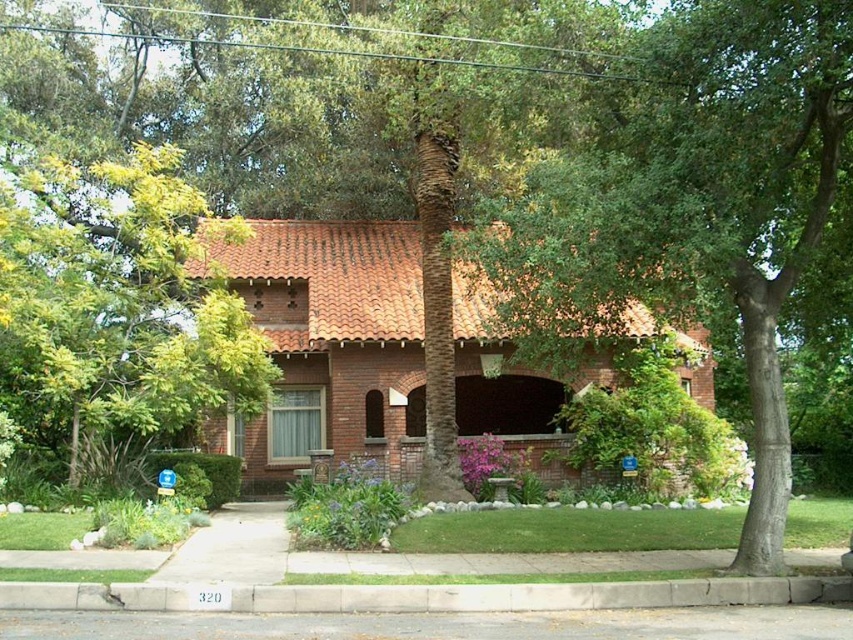
Question: Among these objects, which one is farthest from the camera?

Choices:
 (A) green leafy tree at upper left
 (B) gray concrete curb at lower center

Answer: (A)

Question: Can you confirm if green leafy tree at center is positioned below gray concrete curb at lower center?

Choices:
 (A) yes
 (B) no

Answer: (B)

Question: Can you confirm if green leafy tree at upper left is wider than gray concrete curb at lower center?

Choices:
 (A) no
 (B) yes

Answer: (B)

Question: Which of the following is the farthest from the observer?

Choices:
 (A) (144, 611)
 (B) (108, 188)
 (C) (662, 266)

Answer: (B)

Question: Is green leafy tree at center to the left of green leafy tree at upper left from the viewer's perspective?

Choices:
 (A) no
 (B) yes

Answer: (A)

Question: Which object appears closest to the camera in this image?

Choices:
 (A) green leafy tree at center
 (B) gray concrete curb at lower center
 (C) green leafy tree at upper left

Answer: (A)